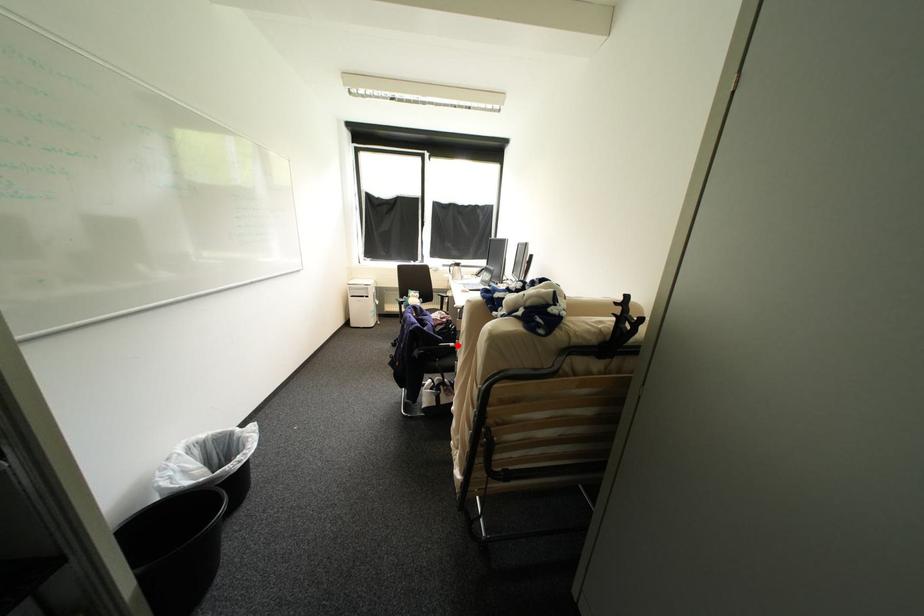
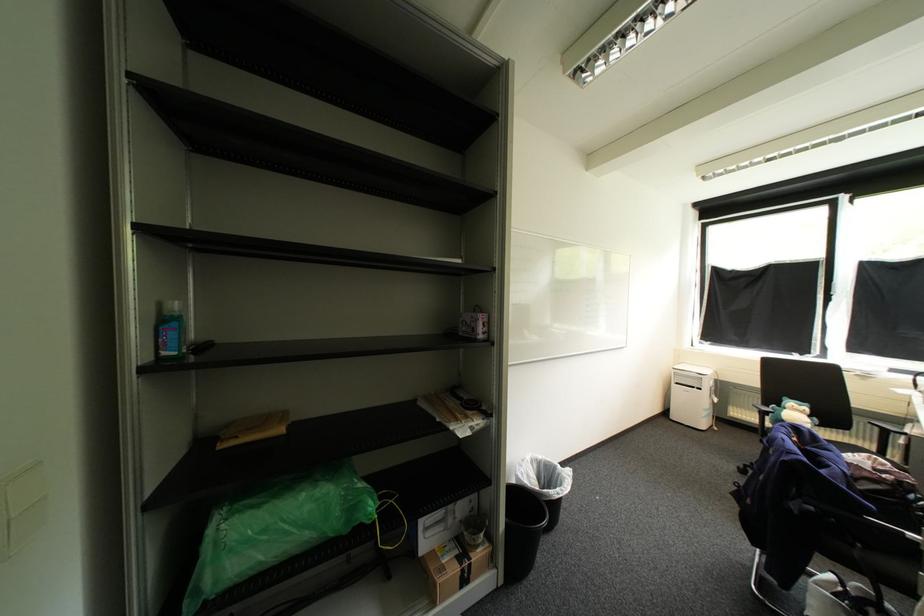
The point at the highlighted location is marked in the first image. Where is the corresponding point in the second image?

(917, 535)